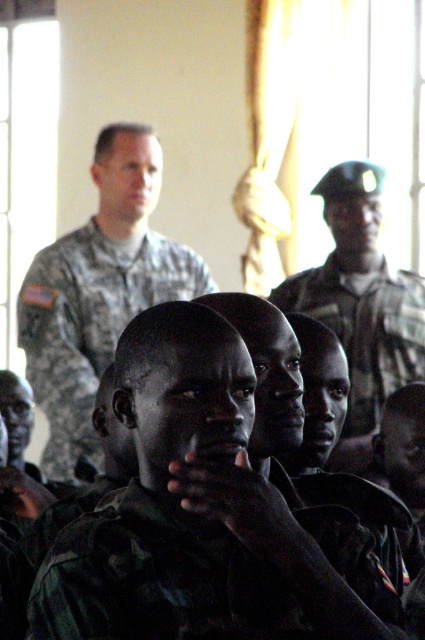
Find the location of a particular element. The height and width of the screenshot is (640, 425). green camouflage uniform at center is located at coordinates (209, 572).

Which is in front, point (33, 630) or point (22, 332)?

Positioned in front is point (33, 630).

Image resolution: width=425 pixels, height=640 pixels. What are the coordinates of `green camouflage uniform at center` in the screenshot? It's located at (209, 572).

Which of these two, camouflage uniform at upper center or camouflage uniform at center, stands taller?

Standing taller between the two is camouflage uniform at upper center.

Can you confirm if camouflage uniform at upper center is positioned to the right of camouflage uniform at center?

In fact, camouflage uniform at upper center is to the left of camouflage uniform at center.

Is point (167, 241) farther from camera compared to point (422, 348)?

That is True.

I want to click on camouflage uniform at upper center, so tap(99, 291).

Does green camouflage uniform at center appear on the left side of camouflage uniform at center?

Yes, green camouflage uniform at center is to the left of camouflage uniform at center.

Does green camouflage uniform at center have a larger size compared to camouflage uniform at center?

Incorrect, green camouflage uniform at center is not larger than camouflage uniform at center.

Which is in front, point (308, 548) or point (404, 342)?

Point (308, 548) is more forward.

Identify the location of green camouflage uniform at center. The width and height of the screenshot is (425, 640). (209, 572).